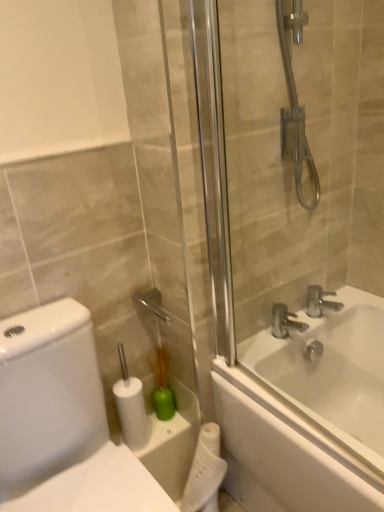
Question: Considering the relative sizes of white matte toilet paper at lower center, the first toilet paper ordered from the bottom, and silver metallic faucet at upper right, marked as the 2th tap in a left-to-right arrangement, in the image provided, is white matte toilet paper at lower center, the first toilet paper ordered from the bottom, smaller than silver metallic faucet at upper right, marked as the 2th tap in a left-to-right arrangement,?

Choices:
 (A) yes
 (B) no

Answer: (B)

Question: Can you confirm if white matte toilet paper at lower center, the 2th toilet paper when ordered from left to right, is wider than silver metallic faucet at upper right, marked as the 2th tap in a left-to-right arrangement?

Choices:
 (A) yes
 (B) no

Answer: (A)

Question: Can you confirm if white matte toilet paper at lower center, which is the first toilet paper from right to left, is positioned to the left of silver metallic faucet at upper right, which is the 1th tap in right-to-left order?

Choices:
 (A) yes
 (B) no

Answer: (A)

Question: Is the position of white matte toilet paper at lower center, which is the first toilet paper from right to left, more distant than that of silver metallic faucet at upper right, marked as the 2th tap in a left-to-right arrangement?

Choices:
 (A) yes
 (B) no

Answer: (B)

Question: Is white matte toilet paper at lower center, the 2th toilet paper when ordered from left to right, located outside silver metallic faucet at upper right, which is the 1th tap in right-to-left order?

Choices:
 (A) no
 (B) yes

Answer: (B)

Question: Is white matte toilet paper at lower center, the first toilet paper ordered from the bottom, looking in the opposite direction of silver metallic faucet at upper right, marked as the 2th tap in a left-to-right arrangement?

Choices:
 (A) no
 (B) yes

Answer: (A)

Question: Is silver metallic faucet at upper right, the 1th tap from the left, looking in the opposite direction of silver metallic faucet at upper right, which is the 1th tap in right-to-left order?

Choices:
 (A) no
 (B) yes

Answer: (A)

Question: Is silver metallic faucet at upper right, positioned as the 2th tap in right-to-left order, at the left side of silver metallic faucet at upper right, marked as the 2th tap in a left-to-right arrangement?

Choices:
 (A) yes
 (B) no

Answer: (A)

Question: Would you say silver metallic faucet at upper right, the 1th tap from the left, is a long distance from silver metallic faucet at upper right, which is the 1th tap in right-to-left order?

Choices:
 (A) yes
 (B) no

Answer: (B)

Question: Does silver metallic faucet at upper right, positioned as the 2th tap in right-to-left order, lie in front of silver metallic faucet at upper right, marked as the 2th tap in a left-to-right arrangement?

Choices:
 (A) no
 (B) yes

Answer: (B)

Question: Can you confirm if silver metallic faucet at upper right, the 1th tap from the left, is wider than silver metallic faucet at upper right, marked as the 2th tap in a left-to-right arrangement?

Choices:
 (A) no
 (B) yes

Answer: (A)

Question: From the image's perspective, is silver metallic faucet at upper right, positioned as the 2th tap in right-to-left order, above silver metallic faucet at upper right, marked as the 2th tap in a left-to-right arrangement?

Choices:
 (A) yes
 (B) no

Answer: (B)

Question: Is white matte toilet paper at lower center, the first toilet paper from the top, not within transparent glass shower door at right?

Choices:
 (A) yes
 (B) no

Answer: (A)